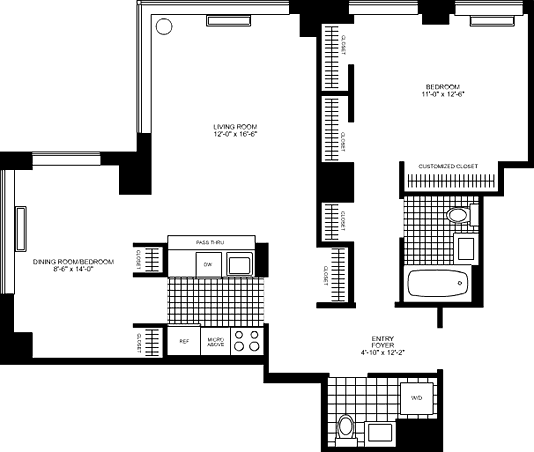
Where is `empty space in bedroom`? empty space in bedroom is located at coordinates (447, 115).